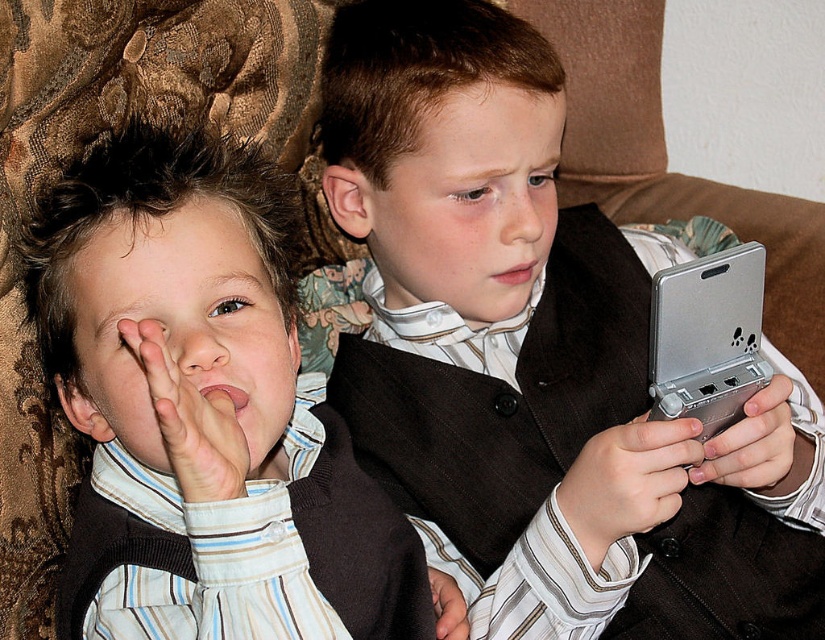
Consider the image. Does matte black vest at center have a smaller size compared to matte brown vest at right?

No.

Is matte black vest at center below matte brown vest at right?

Actually, matte black vest at center is above matte brown vest at right.

Which is behind, point (432, 61) or point (444, 618)?

Point (444, 618)

Find the location of a particular element. The height and width of the screenshot is (640, 825). matte black vest at center is located at coordinates (533, 353).

Who is more forward, (693, 365) or (616, 506)?

Point (616, 506)

Who is more distant from viewer, (x=700, y=301) or (x=615, y=445)?

Positioned behind is point (x=615, y=445).

You are a GUI agent. You are given a task and a screenshot of the screen. Output one action in this format:
    pyautogui.click(x=<x>, y=<y>)
    Task: Click on the silver metallic handheld device at right
    
    Given the screenshot: What is the action you would take?
    pyautogui.click(x=706, y=339)

Is point (752, 378) positioned in front of point (759, 461)?

That is True.

Is silver metallic handheld device at right behind metallic silver controller at right?

No, it is in front of metallic silver controller at right.

This screenshot has width=825, height=640. In order to click on silver metallic handheld device at right in this screenshot , I will do `click(706, 339)`.

In order to click on silver metallic handheld device at right in this screenshot , I will do `click(706, 339)`.